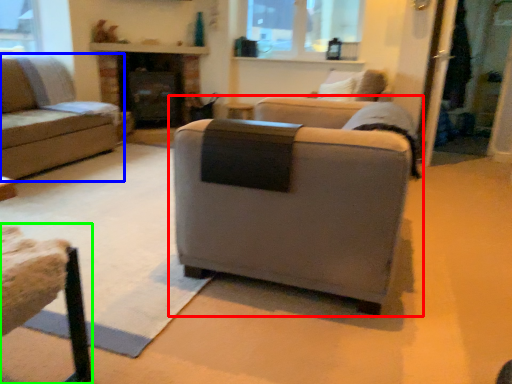
Question: Which object is the farthest from studio couch (highlighted by a red box)? Choose among these: studio couch (highlighted by a blue box) or swivel chair (highlighted by a green box).

Choices:
 (A) studio couch
 (B) swivel chair

Answer: (A)